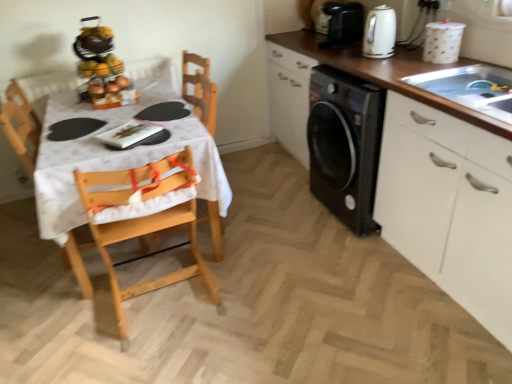
Locate an element on the screen. This screenshot has width=512, height=384. vacant region in front of wooden highchair at left is located at coordinates (158, 350).